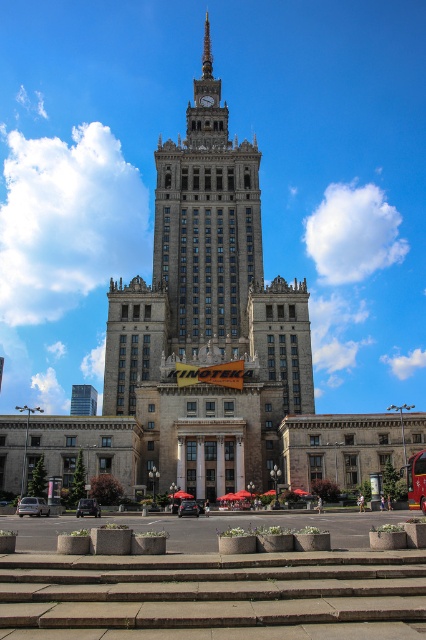
Question: Observing the image, what is the correct spatial positioning of brown stone stairs at center in reference to yellow metallic bus at center?

Choices:
 (A) left
 (B) right

Answer: (A)

Question: Is brown stone stairs at center smaller than yellow metallic bus at center?

Choices:
 (A) yes
 (B) no

Answer: (A)

Question: Which point is farther to the camera?

Choices:
 (A) yellow metallic bus at center
 (B) brown stone stairs at center

Answer: (A)

Question: Is brown stone stairs at center thinner than yellow metallic bus at center?

Choices:
 (A) no
 (B) yes

Answer: (A)

Question: Which object appears closest to the camera in this image?

Choices:
 (A) stone clock tower at center
 (B) yellow metallic bus at center

Answer: (B)

Question: Which object appears closest to the camera in this image?

Choices:
 (A) yellow metallic bus at center
 (B) brown stone stairs at center

Answer: (B)